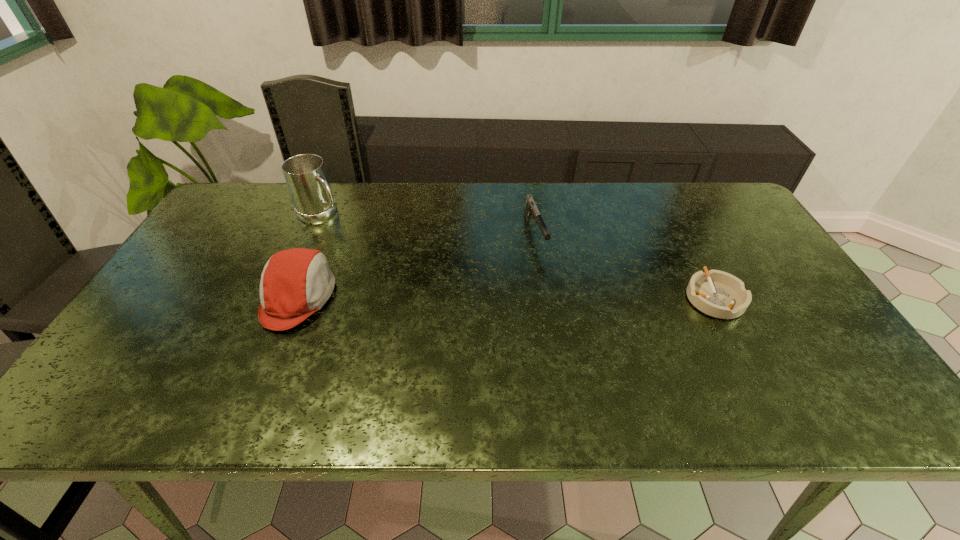
At what (x,y) coordinates should I click in order to perform the action: click on cap. Please return your answer as a coordinate pair (x, y). The image size is (960, 540). Looking at the image, I should click on (295, 283).

Locate an element on the screen. The height and width of the screenshot is (540, 960). the shortest object is located at coordinates (716, 293).

Where is `the rightmost object`? The image size is (960, 540). the rightmost object is located at coordinates (716, 293).

This screenshot has height=540, width=960. Identify the location of gun. (531, 209).

Where is `the second shortest object`? the second shortest object is located at coordinates (531, 209).

Identify the location of the tallest object. The image size is (960, 540). pos(305,174).

Where is `free spot located on the front-facing side of the cap`? This screenshot has height=540, width=960. free spot located on the front-facing side of the cap is located at coordinates (165, 298).

Find the location of a particular element. This screenshot has width=960, height=540. blank space located 0.240m on the front-facing side of the cap is located at coordinates (169, 298).

Find the location of a particular element. This screenshot has width=960, height=540. free space located on the front-facing side of the cap is located at coordinates (196, 298).

Identify the location of vacant region located on the front of the shortest object. The image size is (960, 540). (754, 373).